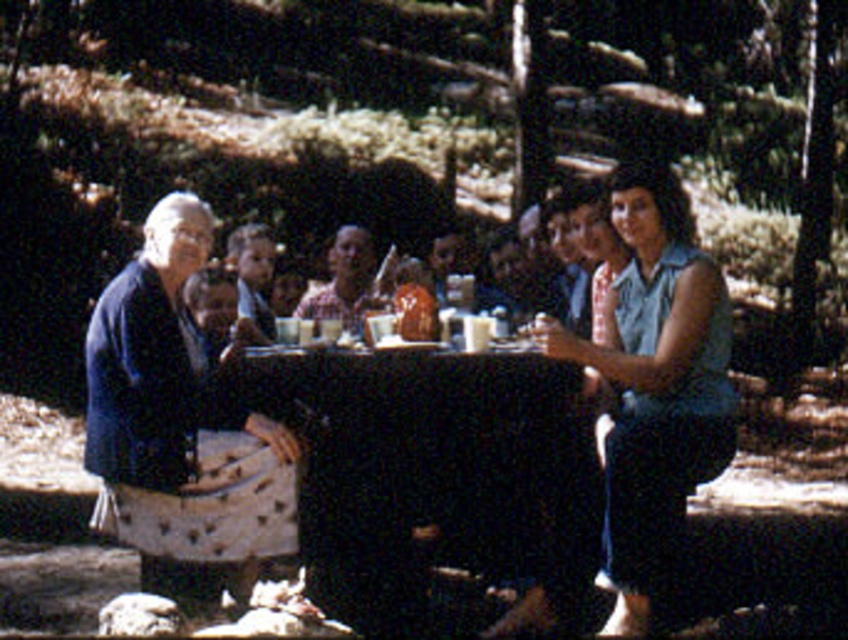
Does black glossy table at center lie in front of smooth brown hair at center?

Yes, black glossy table at center is closer to the viewer.

Who is higher up, black glossy table at center or smooth brown hair at center?

smooth brown hair at center

Is point (510, 499) positioned in front of point (237, 260)?

That is True.

At what (x,y) coordinates should I click in order to perform the action: click on black glossy table at center. Please return your answer as a coordinate pair (x, y). This screenshot has height=640, width=848. Looking at the image, I should click on (441, 467).

Between point (212, 234) and point (347, 273), which one is positioned in front?

Point (212, 234)

This screenshot has width=848, height=640. Identify the location of blue fabric shirt at left. (171, 416).

Where is `blue fabric shirt at left`? The height and width of the screenshot is (640, 848). blue fabric shirt at left is located at coordinates (171, 416).

This screenshot has width=848, height=640. What are the coordinates of `blue fabric dress at center` in the screenshot? It's located at (629, 417).

Does blue fabric dress at center have a greater width compared to smooth brown hair at center?

Yes, blue fabric dress at center is wider than smooth brown hair at center.

Between point (646, 499) and point (249, 257), which one is positioned behind?

The point (249, 257) is more distant.

Locate an element on the screen. The image size is (848, 640). blue fabric dress at center is located at coordinates (629, 417).